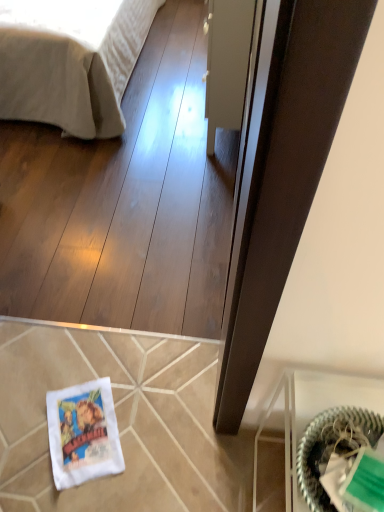
Question: From the image's perspective, is beige cotton bed at upper left above green woven basket at lower right?

Choices:
 (A) no
 (B) yes

Answer: (B)

Question: Does beige cotton bed at upper left appear on the left side of green woven basket at lower right?

Choices:
 (A) no
 (B) yes

Answer: (B)

Question: Can green woven basket at lower right be found inside beige cotton bed at upper left?

Choices:
 (A) no
 (B) yes

Answer: (A)

Question: Is beige cotton bed at upper left not within green woven basket at lower right?

Choices:
 (A) yes
 (B) no

Answer: (A)

Question: From a real-world perspective, is beige cotton bed at upper left on top of green woven basket at lower right?

Choices:
 (A) no
 (B) yes

Answer: (A)

Question: Considering the positions of transparent glass door at center and beige cotton bed at upper left in the image, is transparent glass door at center taller or shorter than beige cotton bed at upper left?

Choices:
 (A) short
 (B) tall

Answer: (B)

Question: Considering their positions, is transparent glass door at center located in front of or behind beige cotton bed at upper left?

Choices:
 (A) front
 (B) behind

Answer: (A)

Question: Does point (243, 37) appear closer or farther from the camera than point (49, 53)?

Choices:
 (A) closer
 (B) farther

Answer: (A)

Question: Looking at their shapes, would you say transparent glass door at center is wider or thinner than beige cotton bed at upper left?

Choices:
 (A) wide
 (B) thin

Answer: (B)

Question: Is beige cotton bed at upper left in front of or behind transparent glass door at center in the image?

Choices:
 (A) behind
 (B) front

Answer: (A)

Question: Do you think beige cotton bed at upper left is within transparent glass door at center, or outside of it?

Choices:
 (A) outside
 (B) inside

Answer: (A)

Question: Looking at their shapes, would you say beige cotton bed at upper left is wider or thinner than transparent glass door at center?

Choices:
 (A) wide
 (B) thin

Answer: (A)

Question: Considering the positions of beige cotton bed at upper left and transparent glass door at center in the image, is beige cotton bed at upper left taller or shorter than transparent glass door at center?

Choices:
 (A) short
 (B) tall

Answer: (A)

Question: Is white fabric bag at lower left inside or outside of green woven basket at lower right?

Choices:
 (A) inside
 (B) outside

Answer: (B)

Question: Relative to green woven basket at lower right, is white fabric bag at lower left in front or behind?

Choices:
 (A) behind
 (B) front

Answer: (A)